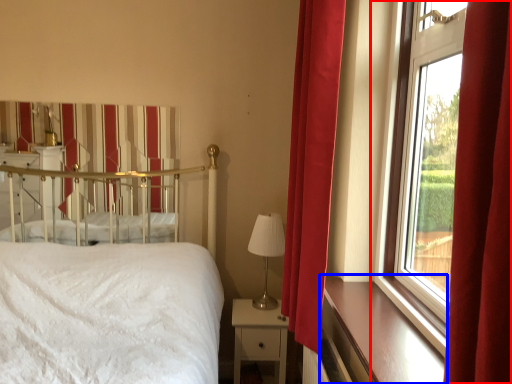
Question: Which of the following is the closest to the observer, window (highlighted by a red box) or window sill (highlighted by a blue box)?

Choices:
 (A) window
 (B) window sill

Answer: (A)